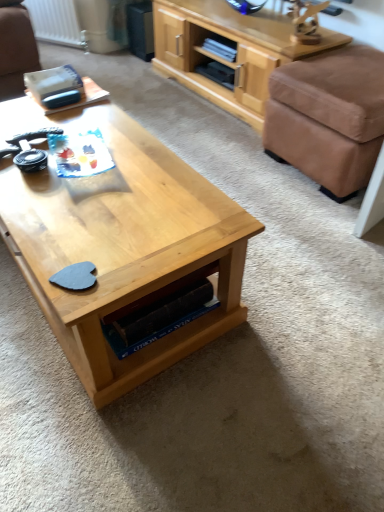
This screenshot has width=384, height=512. I want to click on vacant point to the right of light wood coffee table at center, so click(301, 276).